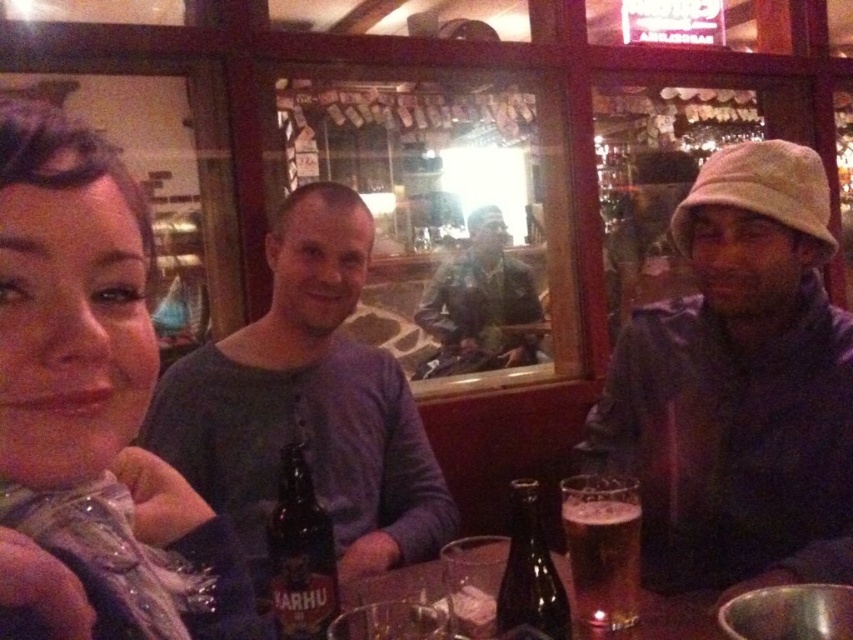
Question: Estimate the real-world distances between objects in this image. Which object is farther from the dark brown glass bottle at center?

Choices:
 (A) matte black scarf at left
 (B) translucent glass beer at center

Answer: (A)

Question: Which object is positioned closest to the matte black scarf at left?

Choices:
 (A) brown glass bottle at center
 (B) purple soft sweater at center
 (C) matte gray hat at right

Answer: (A)

Question: Does camouflage fabric jacket at center have a larger size compared to dark brown glass bottle at center?

Choices:
 (A) yes
 (B) no

Answer: (A)

Question: Which point appears closest to the camera in this image?

Choices:
 (A) (688, 442)
 (B) (566, 538)
 (C) (19, 156)

Answer: (C)

Question: Is brown glass bottle at center above dark brown glass bottle at center?

Choices:
 (A) no
 (B) yes

Answer: (B)

Question: Can you confirm if brown glass bottle at center is bigger than dark brown glass bottle at center?

Choices:
 (A) yes
 (B) no

Answer: (B)